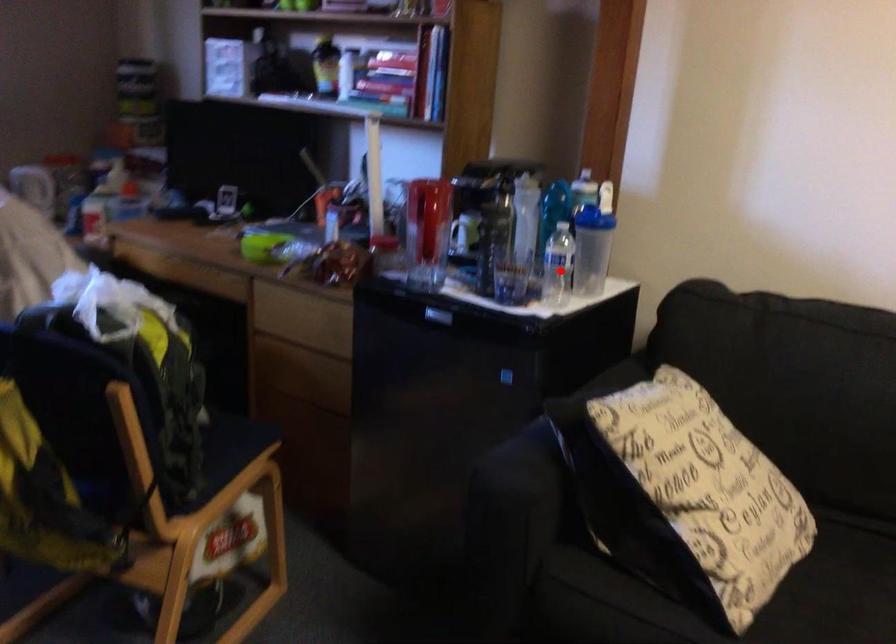
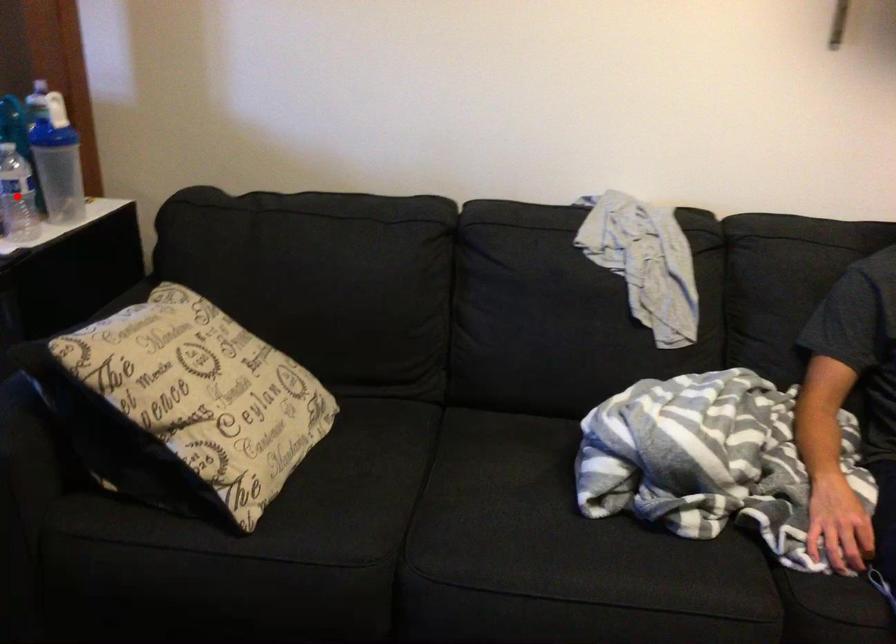
Based on the photo, I am providing you with two images of the same scene from different viewpoints. A red point is marked on the first image and another point is marked on the second image. Is the red point in image1 aligned with the point shown in image2?

Yes